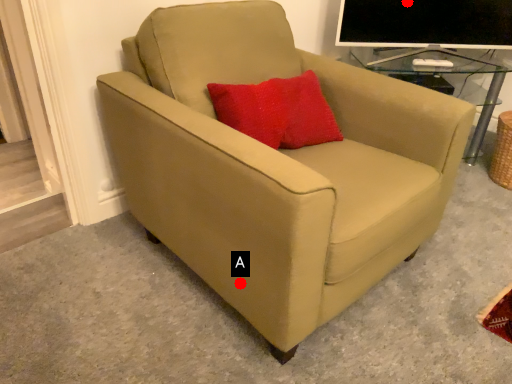
Question: Two points are circled on the image, labeled by A and B beside each circle. Among these points, which one is nearest to the camera?

Choices:
 (A) A is closer
 (B) B is closer

Answer: (A)